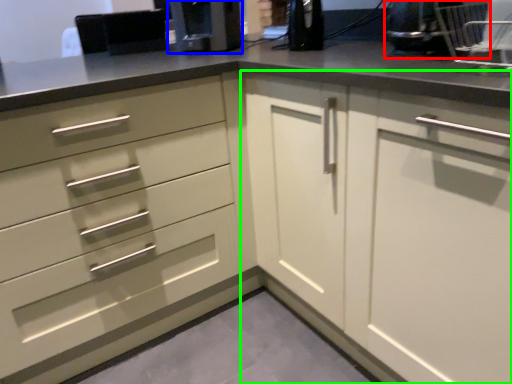
Question: Which is nearer to the appliance (highlighted by a red box)? coffee machine (highlighted by a blue box) or cabinetry (highlighted by a green box).

Choices:
 (A) coffee machine
 (B) cabinetry

Answer: (B)